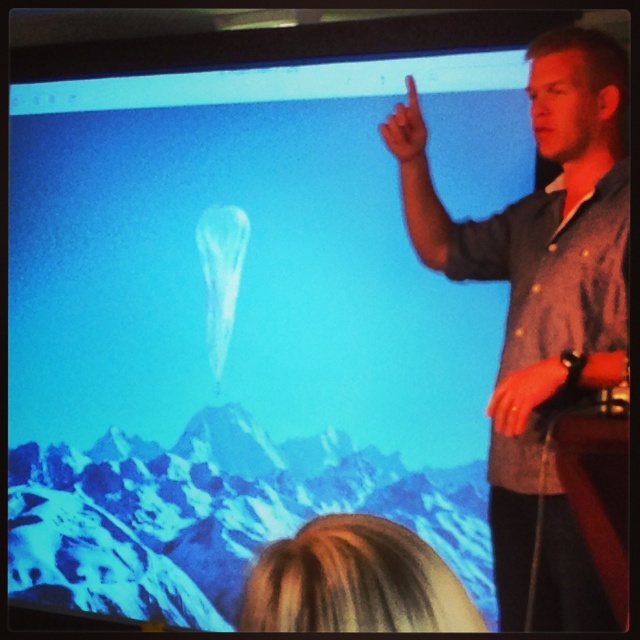
Is gray button-down shirt at upper right taller than matte skin finger at upper center?

Yes, gray button-down shirt at upper right is taller than matte skin finger at upper center.

Is gray button-down shirt at upper right bigger than matte skin finger at upper center?

Yes.

Does point (506, 600) come in front of point (417, 118)?

Yes, point (506, 600) is closer to viewer.

I want to click on gray button-down shirt at upper right, so click(x=547, y=312).

Is point (364, 528) in front of point (406, 90)?

Yes, it is.

Does blonde hair at upper center have a larger size compared to matte skin finger at upper center?

Yes.

Which is in front, point (449, 576) or point (404, 154)?

Point (449, 576) is in front.

The width and height of the screenshot is (640, 640). I want to click on blonde hair at upper center, so click(355, 580).

Who is higher up, gray button-down shirt at upper right or blonde hair at upper center?

gray button-down shirt at upper right

Is point (589, 202) farther from viewer compared to point (291, 564)?

Yes, point (589, 202) is farther from viewer.

The image size is (640, 640). What are the coordinates of `gray button-down shirt at upper right` in the screenshot? It's located at (547, 312).